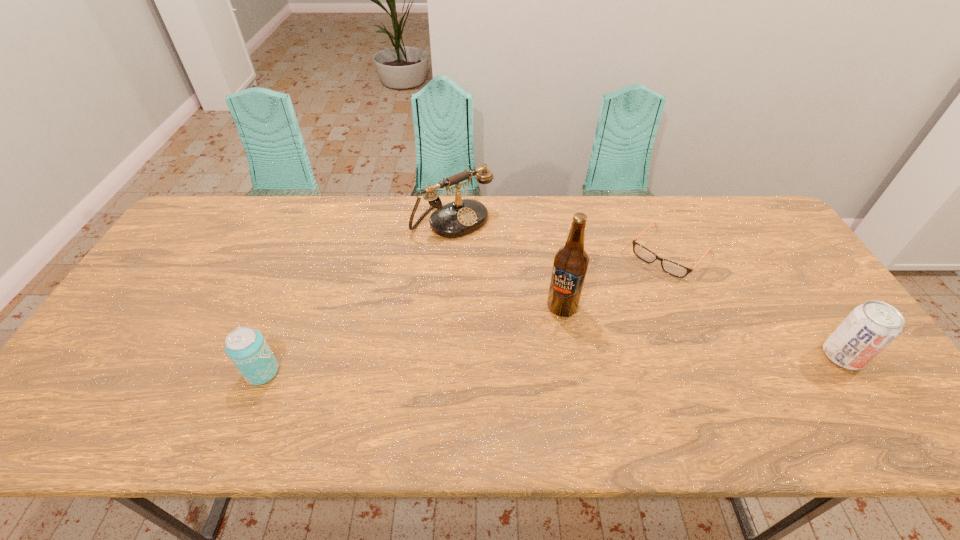
Find the location of `free space that is in between the leftmost object and the rightmost object`. free space that is in between the leftmost object and the rightmost object is located at coordinates (552, 364).

Find the location of a particular element. This screenshot has width=960, height=540. object that is the closest to the fourth object from right to left is located at coordinates (571, 261).

Find the location of `the third closest object to the second shortest object`. the third closest object to the second shortest object is located at coordinates (670, 267).

In order to click on vacant space that satisfies the following two spatial constraints: 1. on the front side of the telephone; 2. on the left side of the spectacles in this screenshot , I will do `click(450, 252)`.

The height and width of the screenshot is (540, 960). I want to click on free space that satisfies the following two spatial constraints: 1. on the front side of the spectacles; 2. on the left side of the soda can, so click(716, 356).